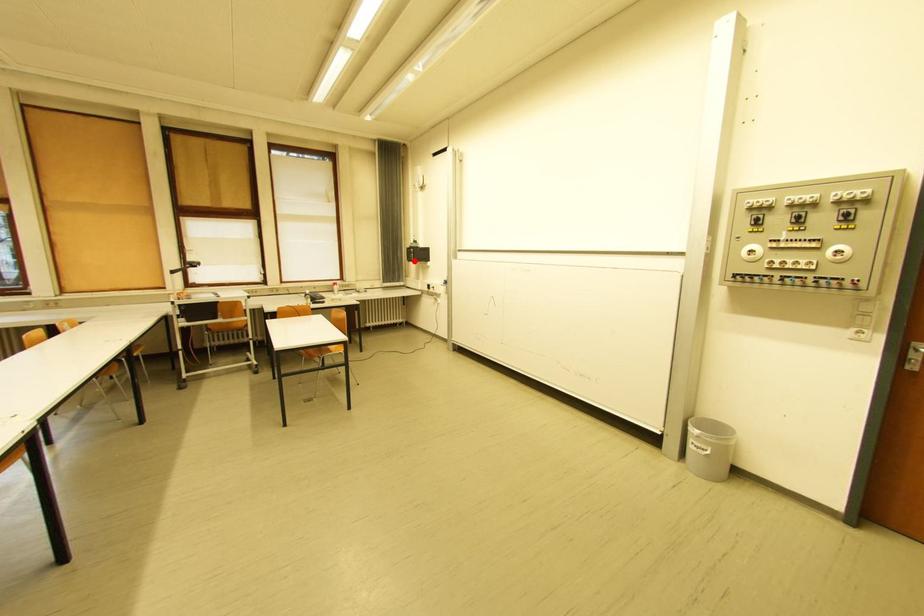
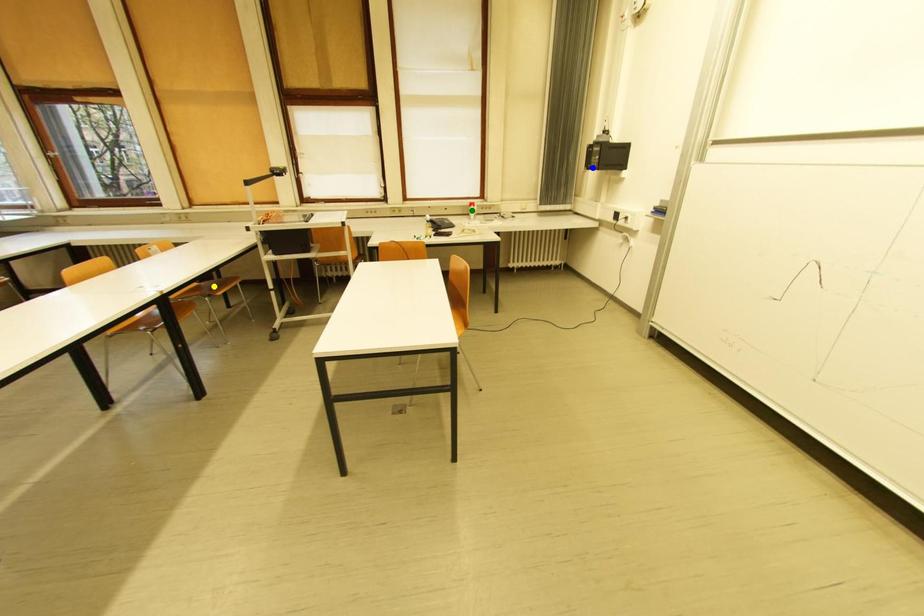
Question: I am providing you with two images of the same scene from different viewpoints. A red point is marked on the first image. You are given multiple points on the second image. Can you choose the point in image 2 that corresponds to the point in image 1?

Choices:
 (A) green point
 (B) blue point
 (C) yellow point

Answer: (B)